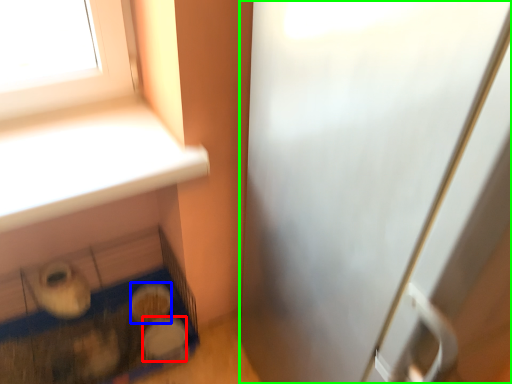
Question: Which object is the farthest from food (highlighted by a red box)? Choose among these: food (highlighted by a blue box) or screen door (highlighted by a green box).

Choices:
 (A) food
 (B) screen door

Answer: (B)